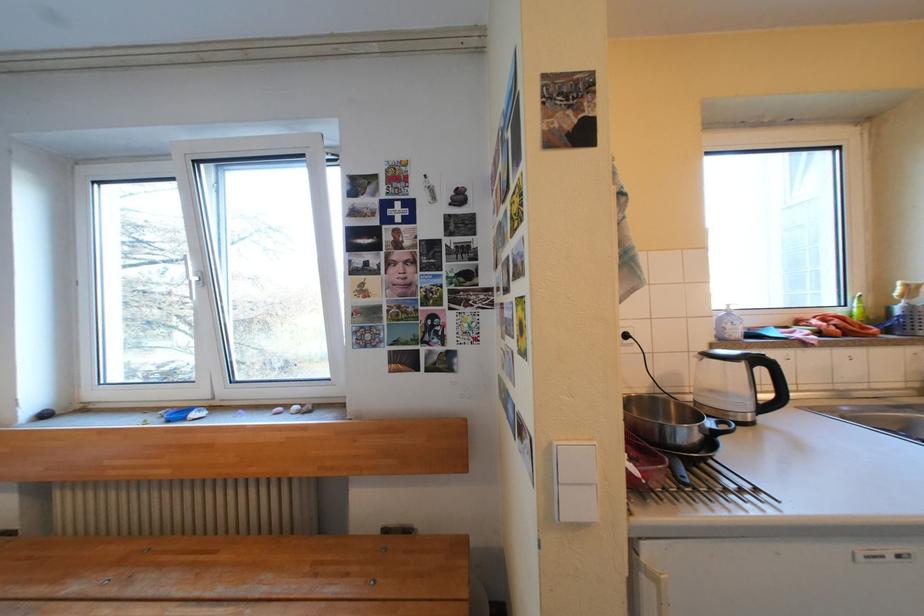
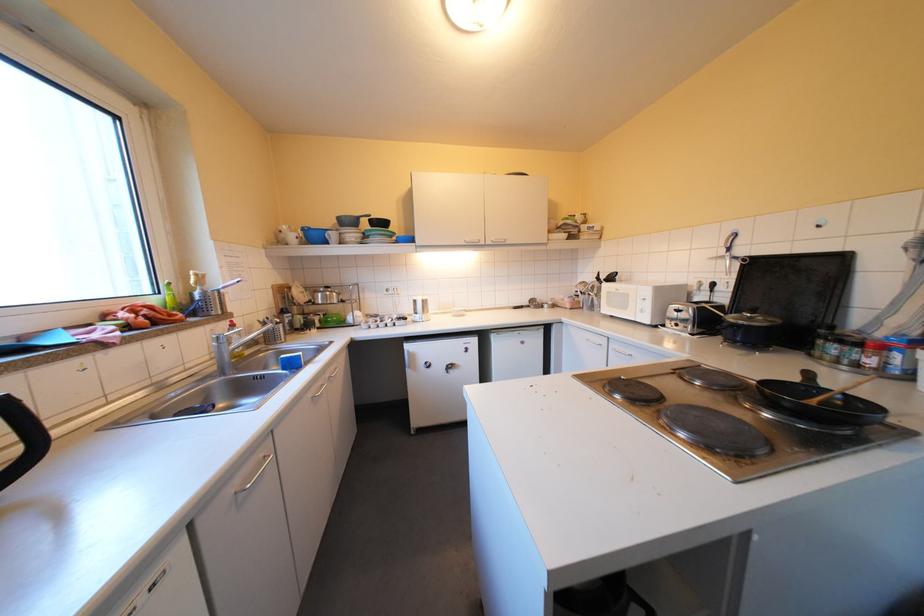
In the second image, find the point that corresponds to (776,408) in the first image.

(17, 479)